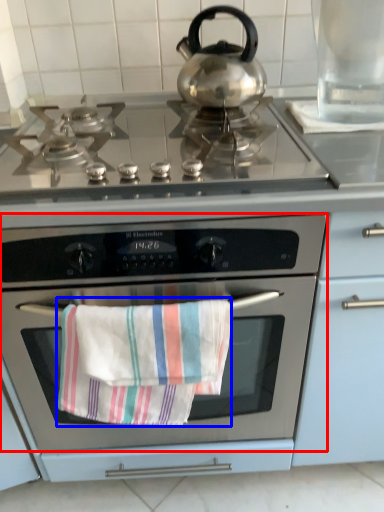
Question: Among these objects, which one is farthest to the camera, oven (highlighted by a red box) or beach towel (highlighted by a blue box)?

Choices:
 (A) oven
 (B) beach towel

Answer: (B)